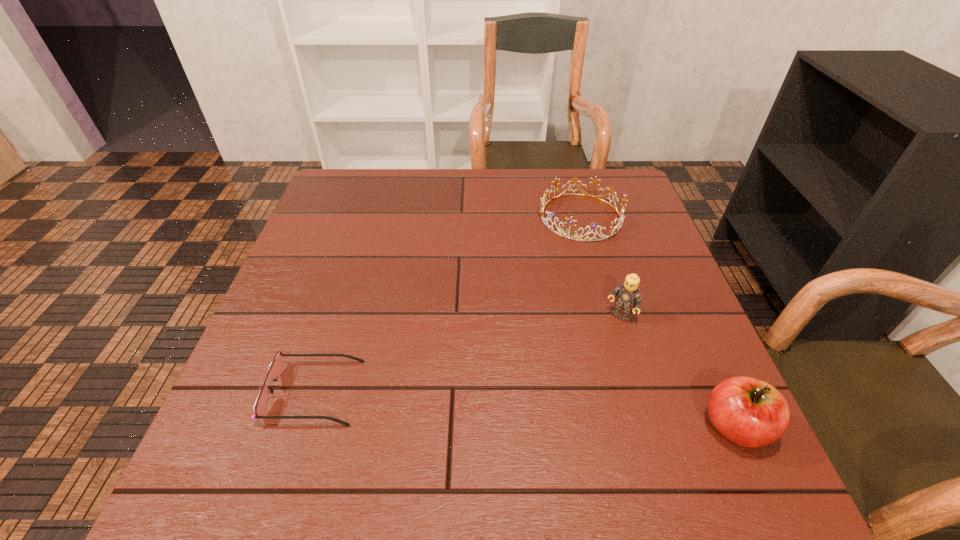
Find the location of `vacant space on the desktop that is between the leftmost object and the apple and is positioned in front of the second farthest object`. vacant space on the desktop that is between the leftmost object and the apple and is positioned in front of the second farthest object is located at coordinates (544, 411).

The height and width of the screenshot is (540, 960). In order to click on vacant space on the desktop that is between the sunglasses and the apple and is positioned on the front-facing side of the tiara in this screenshot , I will do `click(477, 406)`.